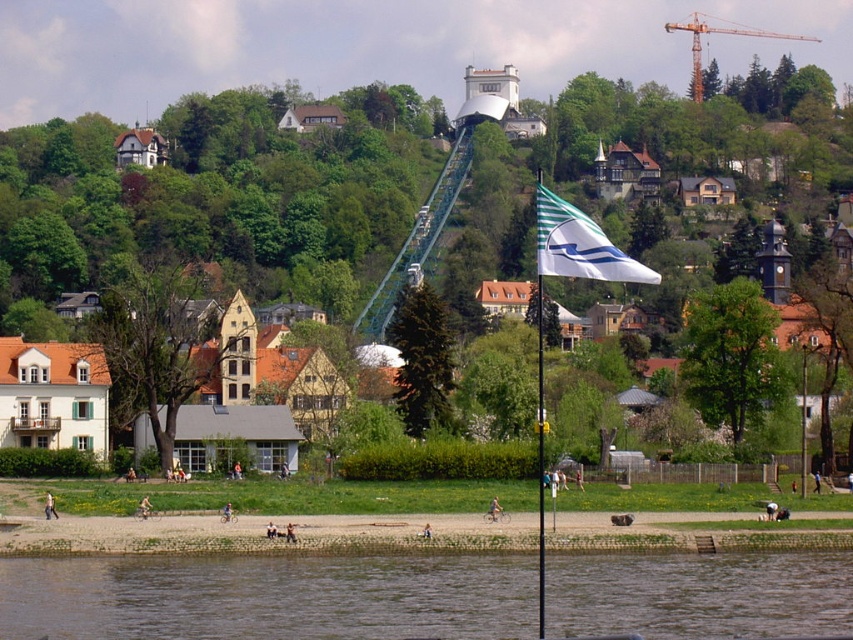
In the scene shown: You are a photographer planning to capture the entire scene in a single shot. The white matte flag at center and brown muddy water at lower center are both important elements. Considering their widths, which object should you position closer to the center of your frame to ensure it doesn

The white matte flag at center has a greater width than the brown muddy water at lower center, so positioning the white matte flag at center closer to the center of the frame will ensure it is captured in full while still including the brown muddy water at lower center.

You are standing on the cobblestone path and want to reach the grassy area beyond the flagpole. Which object must you cross first, the brown muddy water at lower center or the white fabric flag at center?

You must cross the brown muddy water at lower center first because it is located below the white fabric flag at center, meaning it is closer to your starting position on the cobblestone path.